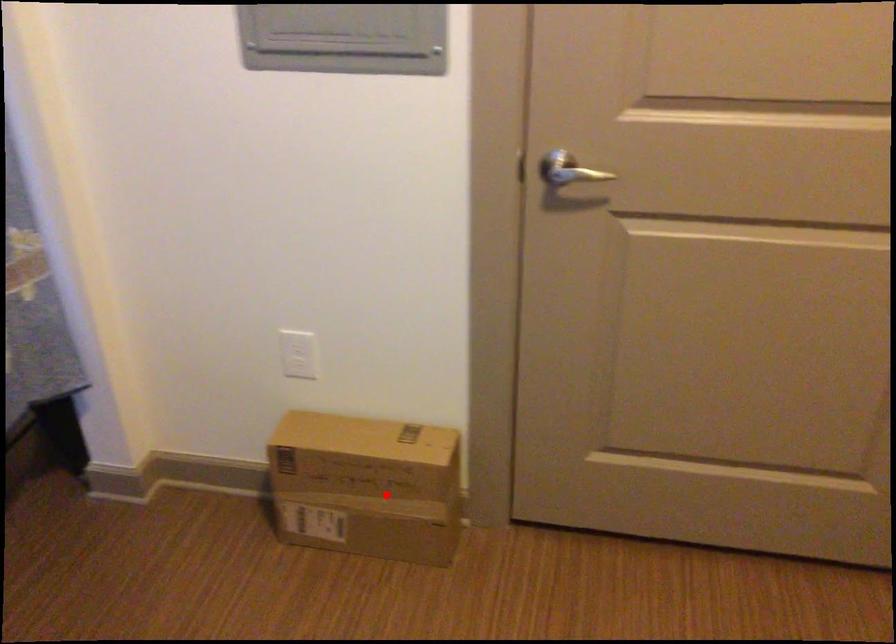
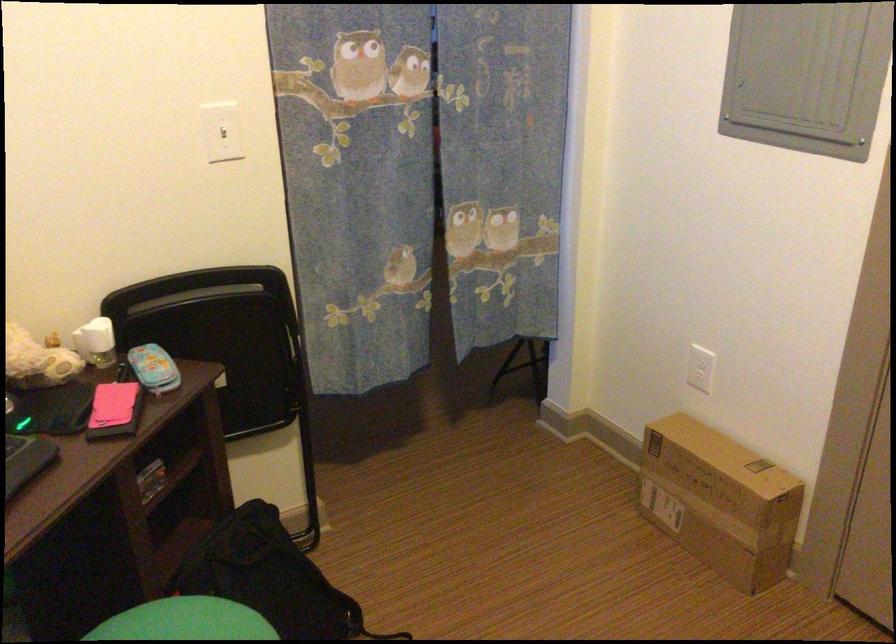
Question: I am providing you with two images of the same scene from different viewpoints. In image1, a red point is highlighted. Considering the same 3D point in image2, which of the following is correct?

Choices:
 (A) It is closer
 (B) It is farther

Answer: (B)